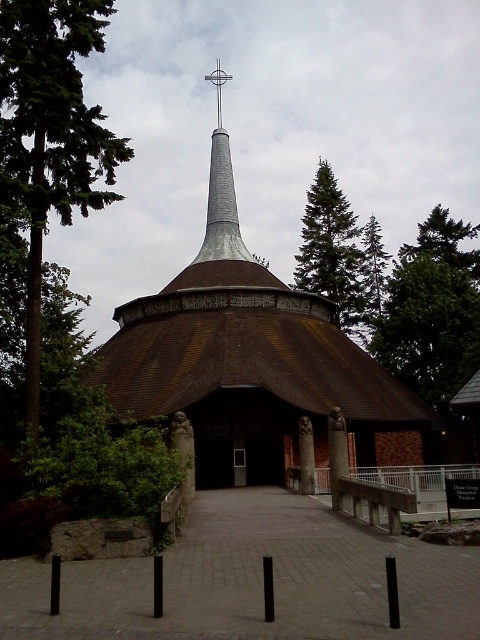
Between point (420, 236) and point (372, 230), which one is positioned behind?

The point (372, 230) is behind.

How far apart are green leafy tree at upper right and green coniferous tree at upper right?

green leafy tree at upper right and green coniferous tree at upper right are 8.25 meters apart.

Between point (464, 240) and point (364, 339), which one is positioned in front?

Positioned in front is point (364, 339).

Locate an element on the screen. The height and width of the screenshot is (640, 480). green leafy tree at upper right is located at coordinates (444, 243).

Can you confirm if brown wooden church at center is wider than green leafy tree at upper right?

No.

Which is in front, point (219, 132) or point (472, 225)?

Point (219, 132) is more forward.

Find the location of a particular element. The image size is (480, 640). brown wooden church at center is located at coordinates (260, 371).

Locate an element on the screen. The width and height of the screenshot is (480, 640). brown wooden church at center is located at coordinates (260, 371).

Which of these two, silver metallic spire at center or green leafy tree at upper right, stands taller?

With more height is silver metallic spire at center.

Is silver metallic spire at center taller than green leafy tree at upper right?

Correct, silver metallic spire at center is much taller as green leafy tree at upper right.

Is point (239, 259) farther from viewer compared to point (402, 260)?

No, it is in front of (402, 260).

The image size is (480, 640). What are the coordinates of `silver metallic spire at center` in the screenshot? It's located at (220, 193).